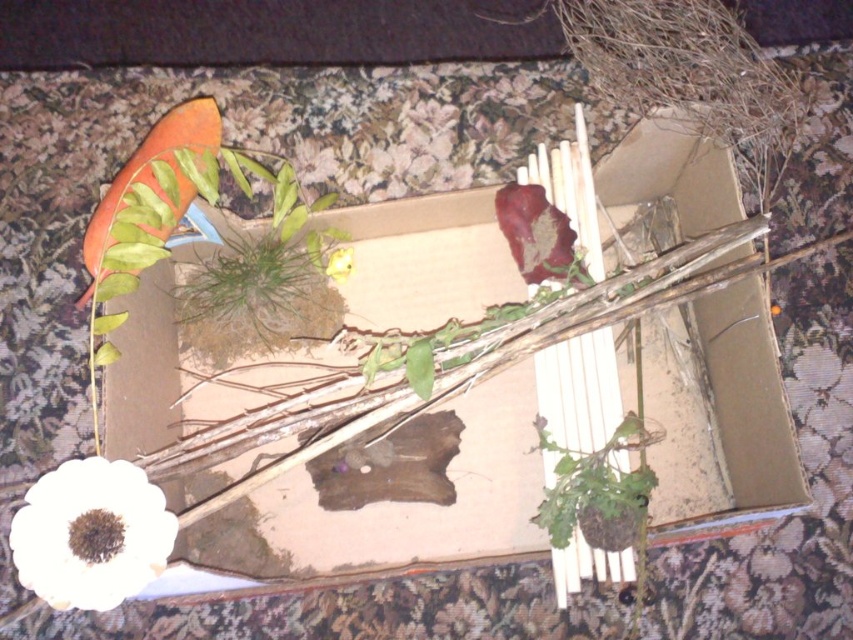
Question: Is brown cardboard box at center to the left of white matte flower at lower left from the viewer's perspective?

Choices:
 (A) yes
 (B) no

Answer: (B)

Question: Which object appears closest to the camera in this image?

Choices:
 (A) green matte plant at lower right
 (B) brown cardboard box at center
 (C) yellow matte flower at center
 (D) white matte flower at lower left

Answer: (D)

Question: Does brown cardboard box at center have a lesser width compared to green matte plant at lower right?

Choices:
 (A) no
 (B) yes

Answer: (A)

Question: Which object is positioned farthest from the white matte flower at lower left?

Choices:
 (A) brown cardboard box at center
 (B) yellow matte flower at center
 (C) green matte plant at lower right

Answer: (C)

Question: Observing the image, what is the correct spatial positioning of white matte flower at lower left in reference to green matte plant at lower right?

Choices:
 (A) above
 (B) below

Answer: (B)

Question: Estimate the real-world distances between objects in this image. Which object is farther from the yellow matte flower at center?

Choices:
 (A) white matte flower at lower left
 (B) green matte plant at lower right
 (C) brown cardboard box at center

Answer: (A)